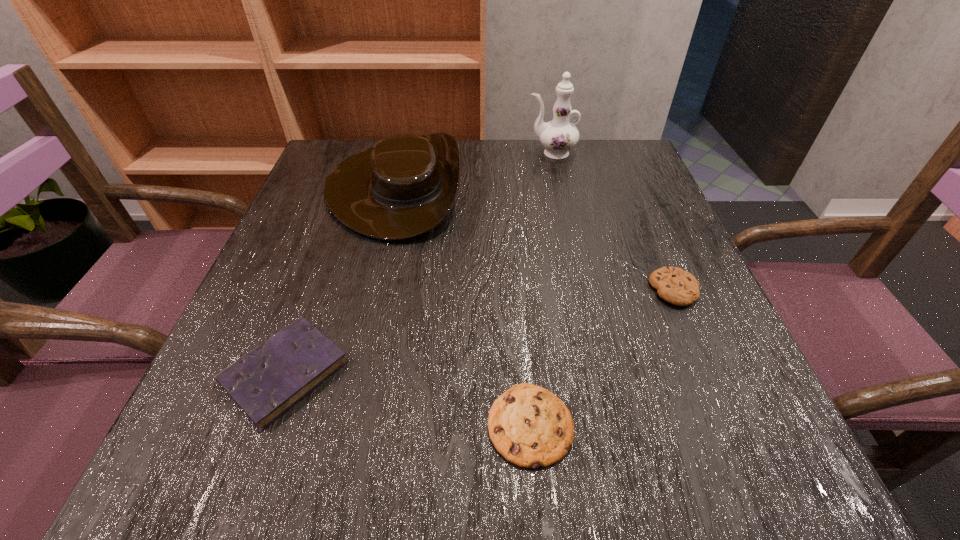
Identify the location of vacant area that lies between the chinaware and the diary. This screenshot has width=960, height=540. (418, 262).

What are the coordinates of `vacant space in between the tallest object and the farther cookie` in the screenshot? It's located at (612, 221).

Where is `object that is the fourth closest to the tallest object`? object that is the fourth closest to the tallest object is located at coordinates (529, 426).

Identify the location of object that stands as the fourth closest to the diary. The height and width of the screenshot is (540, 960). (558, 136).

I want to click on vacant point that satisfies the following two spatial constraints: 1. at the spout of the right cookie; 2. on the right side of the tallest object, so click(x=582, y=289).

I want to click on vacant space that satisfies the following two spatial constraints: 1. on the front side of the cowboy hat; 2. on the right side of the right cookie, so click(x=370, y=289).

Where is `vacant point that satisfies the following two spatial constraints: 1. on the back side of the cowboy hat; 2. on the right side of the diary`? Image resolution: width=960 pixels, height=540 pixels. vacant point that satisfies the following two spatial constraints: 1. on the back side of the cowboy hat; 2. on the right side of the diary is located at coordinates pyautogui.click(x=352, y=187).

Identify the location of free space in the image that satisfies the following two spatial constraints: 1. at the spout of the chinaware; 2. on the left side of the right cookie. This screenshot has width=960, height=540. (582, 289).

Locate an element on the screen. The image size is (960, 540). blank space that satisfies the following two spatial constraints: 1. at the spout of the chinaware; 2. on the back side of the farther cookie is located at coordinates (582, 289).